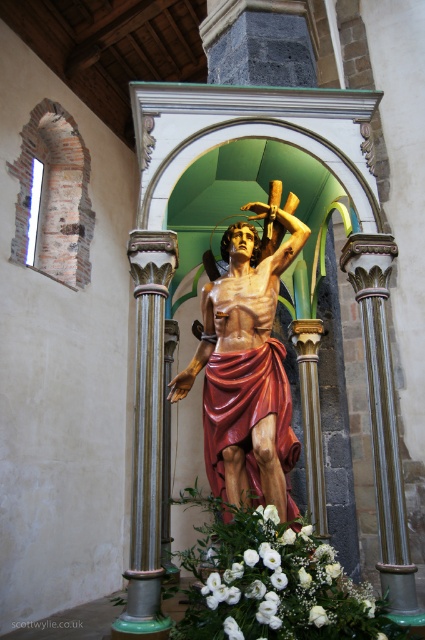
This screenshot has width=425, height=640. What are the coordinates of `wooden statue at center` in the screenshot? It's located at (246, 372).

You are a GUI agent. You are given a task and a screenshot of the screen. Output one action in this format:
    pyautogui.click(x=<x>, y=<y>)
    Task: Click on the wooden statue at center
    This screenshot has width=425, height=640.
    Given the screenshot: What is the action you would take?
    pyautogui.click(x=246, y=372)

Where is `wooden statue at center`? The width and height of the screenshot is (425, 640). wooden statue at center is located at coordinates pos(246,372).

From the picture: Is gold textured column at center taller than white matte flower at center?

Yes.

Can you confirm if gold textured column at center is shorter than white matte flower at center?

Incorrect, gold textured column at center's height does not fall short of white matte flower at center's.

This screenshot has width=425, height=640. Identify the location of gold textured column at center. (382, 419).

Who is positioned more to the left, green marble column at center or gold textured column at center?

Positioned to the left is green marble column at center.

Identify the location of green marble column at center. (147, 435).